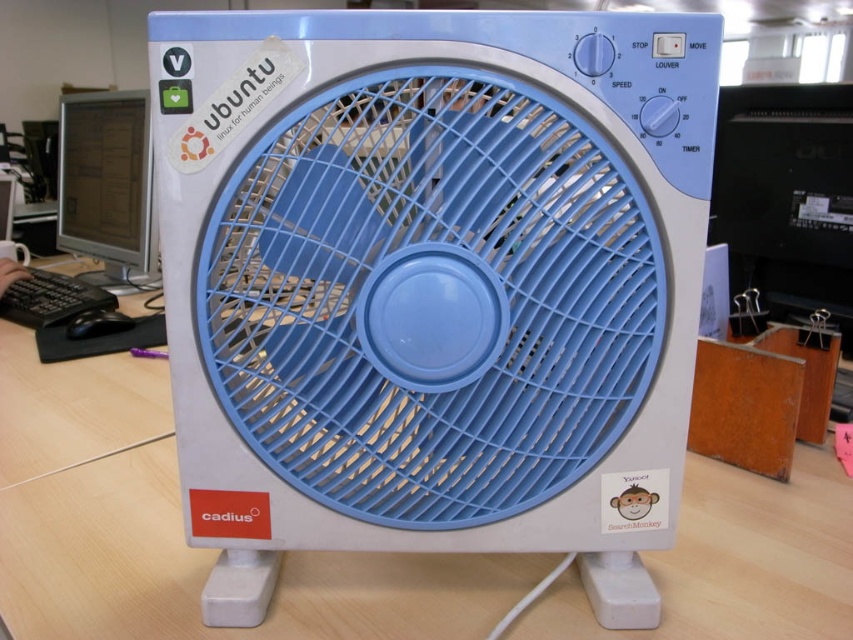
Looking at this image, you are setting up a new desk arrangement and need to place a plant between the white plastic computer desk at center and the matte black monitor at left. Based on their positions, which side of the desk should you place the plant to ensure it is between them?

The white plastic computer desk at center is to the right of the matte black monitor at left, so placing the plant to the left side of the desk would position it between the two objects.

You are organizing a desk and need to place a blue plastic fan at center and a white plastic computer desk at center. According to the scene, which object is positioned to the right of the other?

The blue plastic fan at center is to the right of the white plastic computer desk at center.